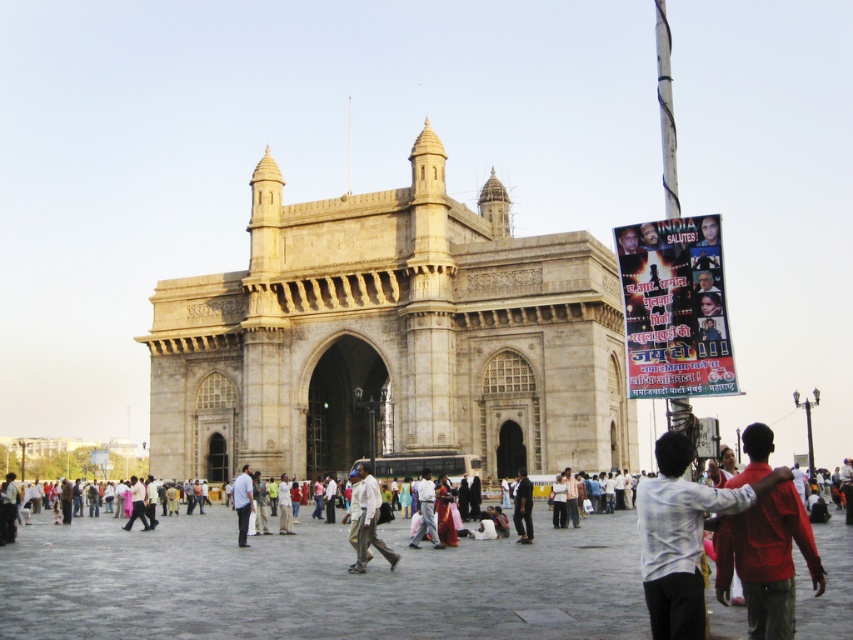
Question: Is dark blue fabric at center positioned before light blue shirt at center?

Choices:
 (A) no
 (B) yes

Answer: (B)

Question: Can you confirm if beige stone gateway of india at center is bigger than white shirt at center?

Choices:
 (A) no
 (B) yes

Answer: (B)

Question: Can you confirm if dark blue fabric at center is thinner than light brown fabric pants at center?

Choices:
 (A) no
 (B) yes

Answer: (B)

Question: Estimate the real-world distances between objects in this image. Which object is farther from the white shirt at center?

Choices:
 (A) beige stone gateway of india at center
 (B) dark blue fabric at center
 (C) stone paved square at center
 (D) light beige fabric shirt at center

Answer: (D)

Question: Which point is closer to the camera?

Choices:
 (A) light blue shirt at center
 (B) white shirt at center
 (C) light brown fabric pants at center
 (D) light beige fabric pants at center

Answer: (B)

Question: Which of the following is the farthest from the observer?

Choices:
 (A) (526, 474)
 (B) (436, 531)
 (C) (233, 484)
 (D) (363, 515)

Answer: (C)